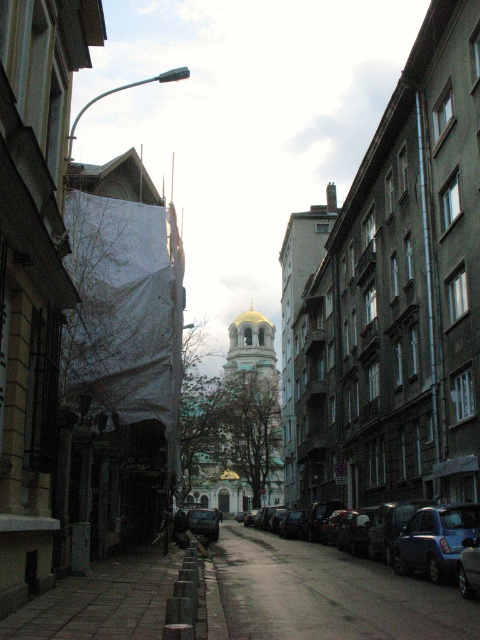
You are a pedestrian walking along the dark asphalt pavement at center. You see the blue metallic car at lower right parked nearby. Which side of the car is the pavement located relative to you?

The dark asphalt pavement at center is positioned on the left side of the blue metallic car at lower right, so the pavement is to the left of the car from your perspective.

You are standing on the gray concrete pavement at lower center and want to walk to the dark asphalt pavement at center. Which direction should you move to reach it?

You should move forward because the dark asphalt pavement at center is further away from you than the gray concrete pavement at lower center where you are standing.

You are a delivery person trying to cross the street from the left side to the right side. The gray concrete pavement at lower center is the only dry path available. Can you walk across it without stepping on the shiny black car at center?

The gray concrete pavement at lower center is thinner than the shiny black car at center, so it is not wide enough to walk around the car. You will have to step on the car or find another path.